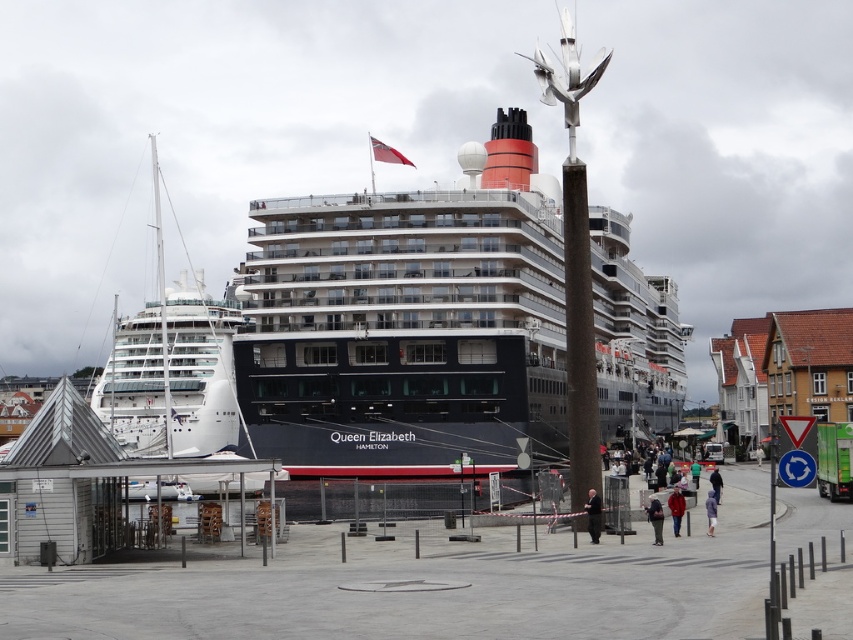
Can you confirm if red fleece jacket at center is smaller than green fabric jacket at lower center?

Yes, red fleece jacket at center is smaller than green fabric jacket at lower center.

Between red fleece jacket at center and green fabric jacket at lower center, which one appears on the right side from the viewer's perspective?

green fabric jacket at lower center

Describe the element at coordinates (676, 508) in the screenshot. The height and width of the screenshot is (640, 853). I see `red fleece jacket at center` at that location.

You are a GUI agent. You are given a task and a screenshot of the screen. Output one action in this format:
    pyautogui.click(x=<x>, y=<y>)
    Task: Click on the red fleece jacket at center
    This screenshot has height=640, width=853.
    Given the screenshot: What is the action you would take?
    pyautogui.click(x=676, y=508)

Does point (663, 515) come closer to viewer compared to point (711, 486)?

Yes, point (663, 515) is closer to viewer.

Who is higher up, dark green pants at center or dark blue jeans at lower right?

dark green pants at center

Is point (651, 515) positioned in front of point (711, 486)?

Yes.

Where is `dark green pants at center`? The height and width of the screenshot is (640, 853). dark green pants at center is located at coordinates click(x=654, y=518).

Between white glossy cruise ship at left and red fleece jacket at center, which one is positioned higher?

white glossy cruise ship at left

From the picture: Between white glossy cruise ship at left and red fleece jacket at center, which one has more height?

white glossy cruise ship at left

At what (x,y) coordinates should I click in order to perform the action: click on white glossy cruise ship at left. Please return your answer as a coordinate pair (x, y). The height and width of the screenshot is (640, 853). Looking at the image, I should click on (172, 369).

The height and width of the screenshot is (640, 853). I want to click on white glossy cruise ship at left, so tap(172, 369).